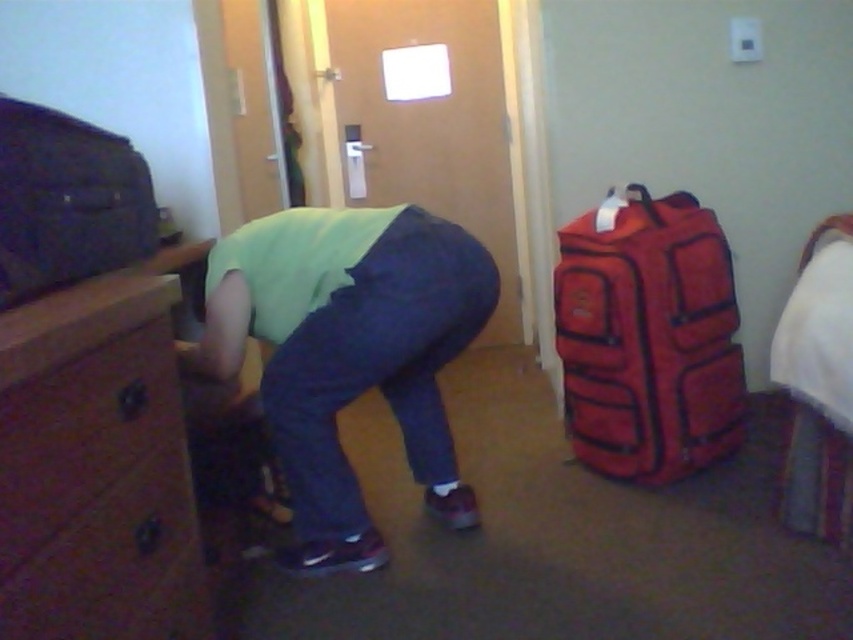
Question: Does green matte shirt at center have a greater width compared to red fabric suitcase at right?

Choices:
 (A) no
 (B) yes

Answer: (B)

Question: Is brown wood dresser at left positioned in front of green matte shirt at center?

Choices:
 (A) no
 (B) yes

Answer: (B)

Question: Among these points, which one is farthest from the camera?

Choices:
 (A) (154, 593)
 (B) (654, 308)
 (C) (26, 244)

Answer: (B)

Question: In this image, where is brown wood dresser at left located relative to matte black suitcase at left?

Choices:
 (A) above
 (B) below

Answer: (B)

Question: Which point appears closest to the camera in this image?

Choices:
 (A) [26, 205]
 (B) [334, 321]
 (C) [61, 355]
 (D) [572, 422]

Answer: (C)

Question: Which object is the farthest from the red fabric suitcase at right?

Choices:
 (A) green matte shirt at center
 (B) brown wood dresser at left

Answer: (B)